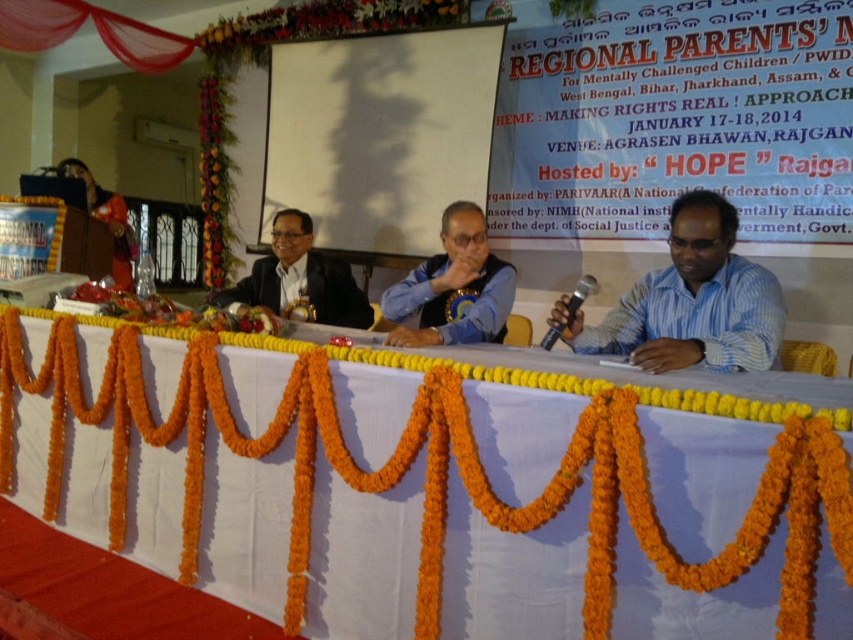
Question: Can you confirm if white fabric table at center is bigger than satin black suit at center?

Choices:
 (A) no
 (B) yes

Answer: (B)

Question: Can you confirm if white matte projector screen at center is bigger than black metallic microphone at center?

Choices:
 (A) no
 (B) yes

Answer: (B)

Question: Which point appears farthest from the camera in this image?

Choices:
 (A) (434, 440)
 (B) (126, 273)
 (C) (384, 36)
 (D) (401, 298)

Answer: (B)

Question: Is matte blue shirt at center wider than satin black suit at center?

Choices:
 (A) yes
 (B) no

Answer: (B)

Question: Which point appears closest to the camera in this image?

Choices:
 (A) (637, 452)
 (B) (671, 349)
 (C) (115, 253)
 (D) (311, 321)

Answer: (A)

Question: Among these objects, which one is nearest to the camera?

Choices:
 (A) black metallic microphone at center
 (B) matte black jacket at left

Answer: (A)